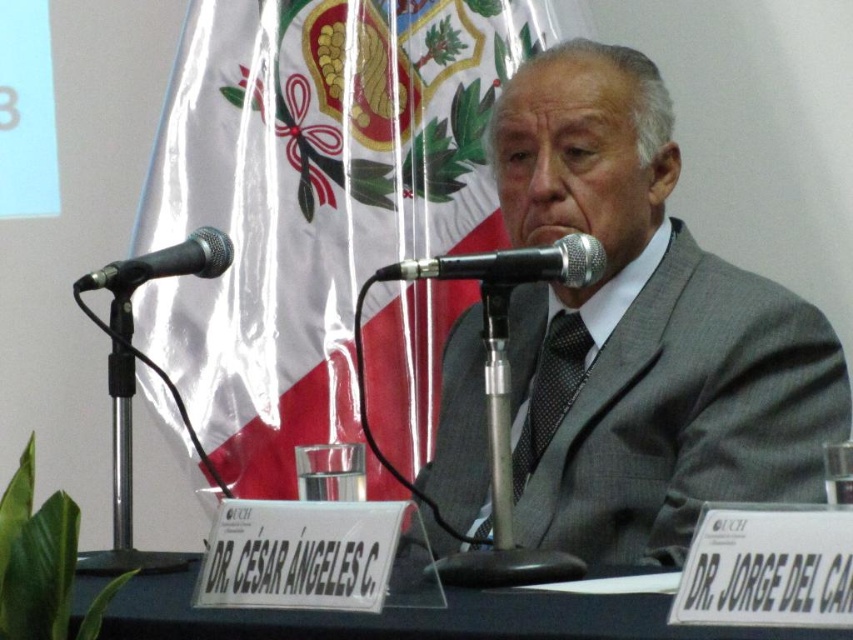
Question: Does gray textured suit at center appear under black metallic microphone at left?

Choices:
 (A) no
 (B) yes

Answer: (B)

Question: Does gray textured suit at center have a lesser width compared to black plastic table at center?

Choices:
 (A) no
 (B) yes

Answer: (B)

Question: Estimate the real-world distances between objects in this image. Which object is closer to the black plastic table at center?

Choices:
 (A) gray textured suit at center
 (B) silky fabric flag at center
 (C) black textured tie at center
 (D) black metallic microphone at center

Answer: (D)

Question: Which of these objects is positioned closest to the black metallic microphone at center?

Choices:
 (A) black textured tie at center
 (B) gray textured suit at center
 (C) silky fabric flag at center

Answer: (B)

Question: Among these objects, which one is nearest to the camera?

Choices:
 (A) black metallic microphone at left
 (B) black plastic table at center
 (C) black textured tie at center
 (D) silky fabric flag at center

Answer: (B)

Question: Can you confirm if gray textured suit at center is smaller than black plastic table at center?

Choices:
 (A) no
 (B) yes

Answer: (A)